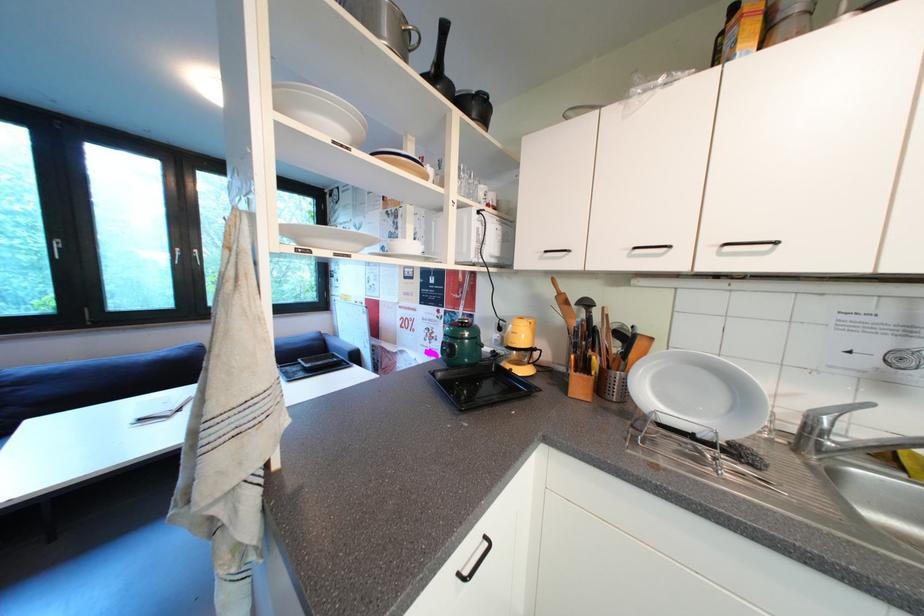
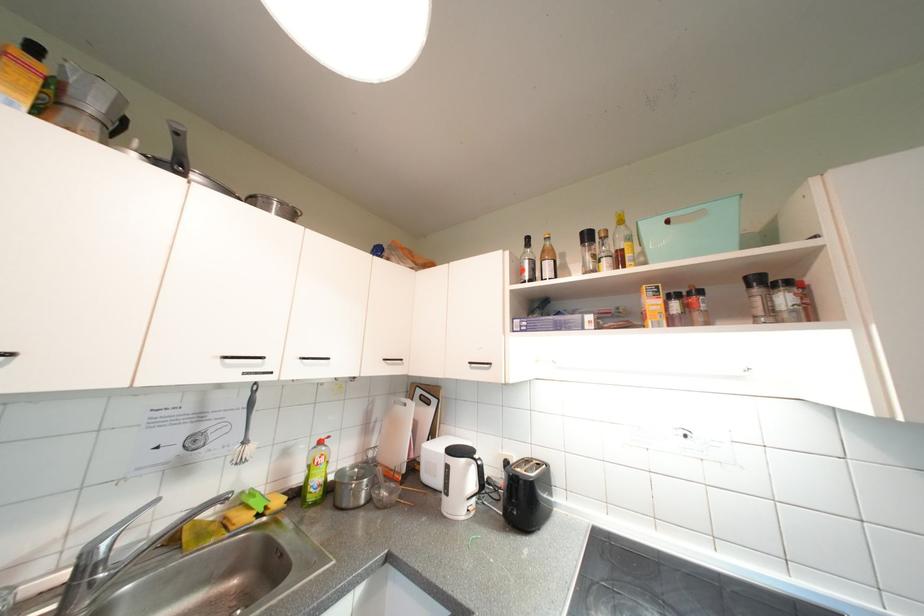
Question: How did the camera likely rotate?

Choices:
 (A) Left
 (B) Right
 (C) Up
 (D) Down

Answer: (B)